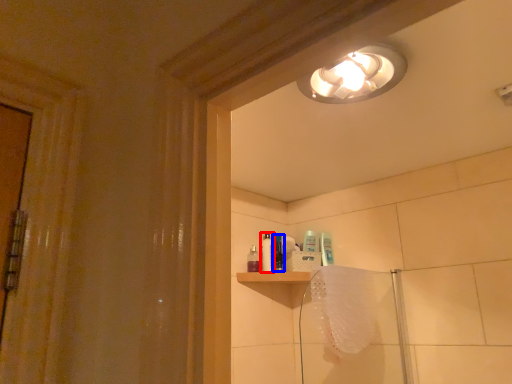
Question: Among these objects, which one is farthest to the camera, toiletry (highlighted by a red box) or toiletry (highlighted by a blue box)?

Choices:
 (A) toiletry
 (B) toiletry

Answer: (A)